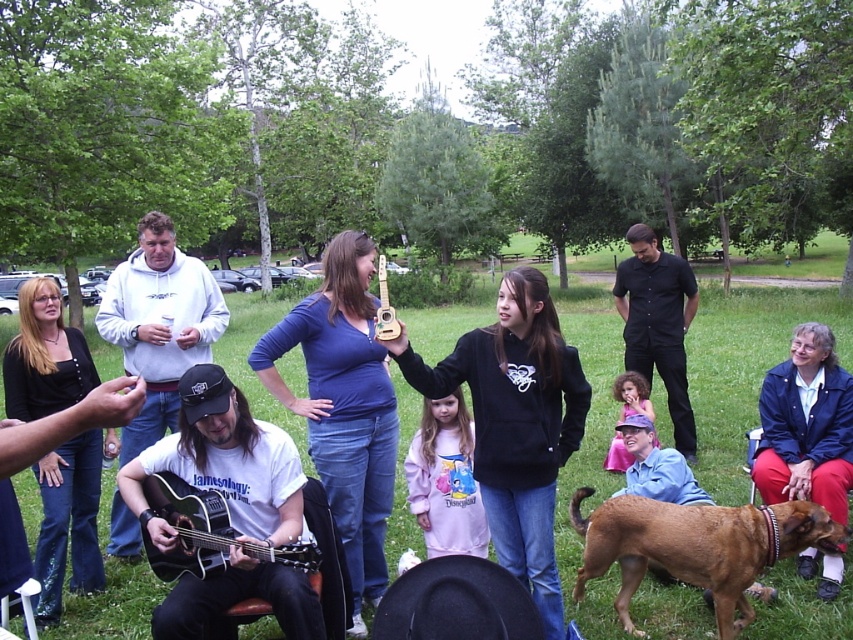
Is black matte guitar at center to the right of brown fur dog at lower right from the viewer's perspective?

Incorrect, black matte guitar at center is not on the right side of brown fur dog at lower right.

Image resolution: width=853 pixels, height=640 pixels. What do you see at coordinates (223, 464) in the screenshot?
I see `black matte guitar at center` at bounding box center [223, 464].

At what (x,y) coordinates should I click in order to perform the action: click on black matte guitar at center. Please return your answer as a coordinate pair (x, y). The width and height of the screenshot is (853, 640). Looking at the image, I should click on (223, 464).

Is blue denim jacket at lower right taller than wooden acoustic guitar at center?

Correct, blue denim jacket at lower right is much taller as wooden acoustic guitar at center.

Between point (817, 465) and point (380, 289), which one is positioned in front?

Positioned in front is point (380, 289).

Which is in front, point (836, 589) or point (381, 301)?

Point (381, 301) is in front.

This screenshot has width=853, height=640. In order to click on blue denim jacket at lower right in this screenshot , I will do `click(805, 426)`.

Between point (599, 529) and point (193, 529), which one is positioned in front?

Point (193, 529)

Is point (737, 524) positioned in front of point (193, 570)?

That is False.

At what (x,y) coordinates should I click in order to perform the action: click on brown fur dog at lower right. Please return your answer as a coordinate pair (x, y). Looking at the image, I should click on (695, 547).